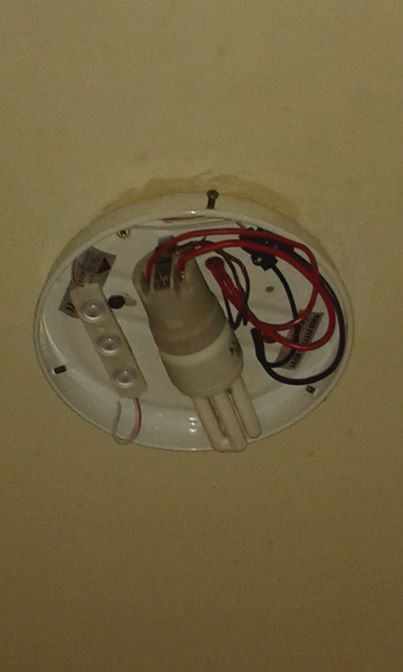
Where is `unpainted spot on ceiling`? Image resolution: width=403 pixels, height=672 pixels. unpainted spot on ceiling is located at coordinates (245, 187).